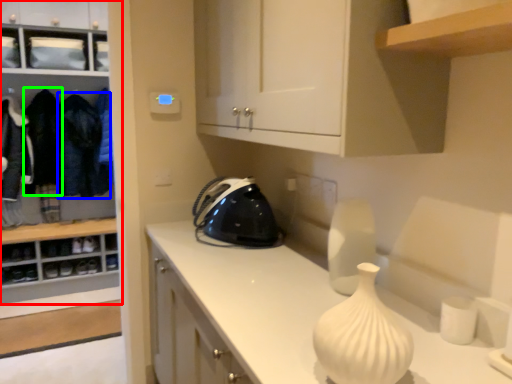
Question: Based on their relative distances, which object is nearer to cabinetry (highlighted by a red box)? Choose from clothing (highlighted by a blue box) and clothing (highlighted by a green box).

Choices:
 (A) clothing
 (B) clothing

Answer: (A)